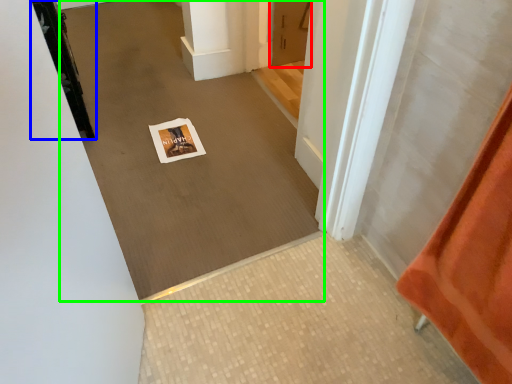
Question: Which object is the closest to the door (highlighted by a red box)? Choose among these: door (highlighted by a blue box) or plain (highlighted by a green box).

Choices:
 (A) door
 (B) plain

Answer: (B)